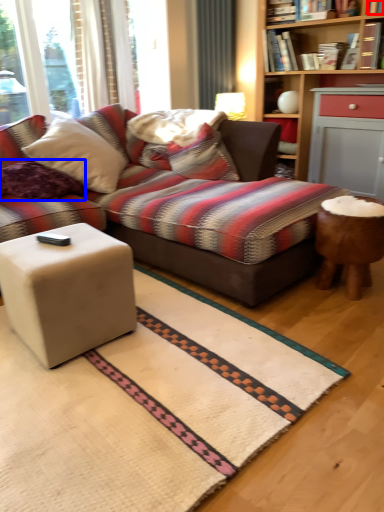
Question: Among these objects, which one is nearest to the camera, book (highlighted by a red box) or pillow (highlighted by a blue box)?

Choices:
 (A) book
 (B) pillow

Answer: (B)